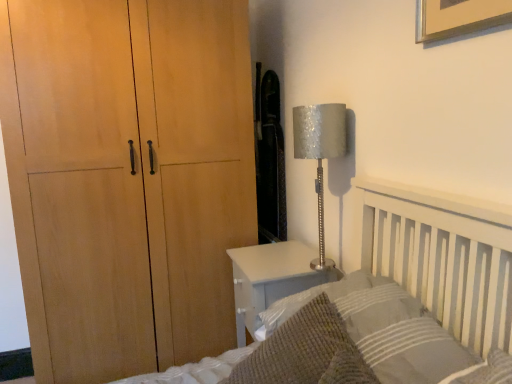
This screenshot has height=384, width=512. I want to click on knitted wool throw pillow at lower right, so click(x=306, y=352).

Locate an element on the screen. The width and height of the screenshot is (512, 384). silver textured lampshade at right is located at coordinates (320, 153).

The height and width of the screenshot is (384, 512). Describe the element at coordinates (271, 278) in the screenshot. I see `white glossy nightstand at lower right` at that location.

Locate an element on the screen. The width and height of the screenshot is (512, 384). textured gray pillow at lower right is located at coordinates (384, 328).

Is knitted wool throw pillow at lower right turned away from textured gray pillow at lower right?

Yes, textured gray pillow at lower right is at the back of knitted wool throw pillow at lower right.

Is knitted wool throw pillow at lower right in contact with textured gray pillow at lower right?

knitted wool throw pillow at lower right is not next to textured gray pillow at lower right, and they're not touching.

From a real-world perspective, which is physically below, knitted wool throw pillow at lower right or textured gray pillow at lower right?

knitted wool throw pillow at lower right.

Based on the photo, from the image's perspective, between knitted wool throw pillow at lower right and textured gray pillow at lower right, which one is located above?

From the image's view, textured gray pillow at lower right is above.

The height and width of the screenshot is (384, 512). I want to click on nightstand lying on the left of textured gray pillow at lower right, so click(x=271, y=278).

In the scene shown: Is white glossy nightstand at lower right far from textured gray pillow at lower right?

They are positioned close to each other.

Which of these two, white glossy nightstand at lower right or textured gray pillow at lower right, is smaller?

textured gray pillow at lower right is smaller.

Considering the relative sizes of white glossy nightstand at lower right and textured gray pillow at lower right in the image provided, is white glossy nightstand at lower right taller than textured gray pillow at lower right?

Indeed, white glossy nightstand at lower right has a greater height compared to textured gray pillow at lower right.

Between silver textured lampshade at right and knitted wool throw pillow at lower right, which one has less height?

knitted wool throw pillow at lower right.

From the image's perspective, is silver textured lampshade at right positioned above or below knitted wool throw pillow at lower right?

Clearly, from the image's perspective, silver textured lampshade at right is above knitted wool throw pillow at lower right.

Does silver textured lampshade at right have a smaller size compared to knitted wool throw pillow at lower right?

Indeed, silver textured lampshade at right has a smaller size compared to knitted wool throw pillow at lower right.

From the picture: Does knitted wool throw pillow at lower right have a smaller size compared to white glossy nightstand at lower right?

Correct, knitted wool throw pillow at lower right occupies less space than white glossy nightstand at lower right.

How distant is knitted wool throw pillow at lower right from white glossy nightstand at lower right?

knitted wool throw pillow at lower right and white glossy nightstand at lower right are 18.97 inches apart.

From their relative heights in the image, would you say knitted wool throw pillow at lower right is taller or shorter than white glossy nightstand at lower right?

knitted wool throw pillow at lower right is shorter than white glossy nightstand at lower right.

Is point (249, 262) closer or farther from the camera than point (340, 322)?

Point (249, 262) appears to be farther away from the viewer than point (340, 322).

This screenshot has height=384, width=512. Find the location of `throw pillow above the white glossy nightstand at lower right (from a real-world perspective)`. throw pillow above the white glossy nightstand at lower right (from a real-world perspective) is located at coordinates (306, 352).

Does white glossy nightstand at lower right have a lesser height compared to knitted wool throw pillow at lower right?

In fact, white glossy nightstand at lower right may be taller than knitted wool throw pillow at lower right.

Is white glossy nightstand at lower right facing towards knitted wool throw pillow at lower right?

No, white glossy nightstand at lower right is not oriented towards knitted wool throw pillow at lower right.

From the picture: From a real-world perspective, is textured gray pillow at lower right located higher than white glossy nightstand at lower right?

Yes, from a real-world perspective, textured gray pillow at lower right is over white glossy nightstand at lower right

Considering the sizes of objects textured gray pillow at lower right and white glossy nightstand at lower right in the image provided, who is thinner, textured gray pillow at lower right or white glossy nightstand at lower right?

Thinner between the two is textured gray pillow at lower right.

Is textured gray pillow at lower right completely or partially outside of white glossy nightstand at lower right?

That's correct, textured gray pillow at lower right is outside of white glossy nightstand at lower right.

Which is in front, point (391, 329) or point (241, 312)?

Point (391, 329)

In the image, there is a silver textured lampshade at right. Where is `throw pillow below it (from a real-world perspective)`? throw pillow below it (from a real-world perspective) is located at coordinates (306, 352).

Based on the photo, is knitted wool throw pillow at lower right directly adjacent to silver textured lampshade at right?

No.

Considering the relative positions of knitted wool throw pillow at lower right and silver textured lampshade at right in the image provided, is knitted wool throw pillow at lower right to the left or to the right of silver textured lampshade at right?

From the image, it's evident that knitted wool throw pillow at lower right is to the left of silver textured lampshade at right.

Can you confirm if knitted wool throw pillow at lower right is taller than silver textured lampshade at right?

In fact, knitted wool throw pillow at lower right may be shorter than silver textured lampshade at right.

This screenshot has width=512, height=384. Identify the location of throw pillow on the left of textured gray pillow at lower right. point(306,352).

In order to click on nightstand located behind the textured gray pillow at lower right in this screenshot , I will do `click(271, 278)`.

Considering their positions, is silver textured lampshade at right positioned further to knitted wool throw pillow at lower right than textured gray pillow at lower right?

silver textured lampshade at right lies further to knitted wool throw pillow at lower right than the other object.

Considering their positions, is white glossy nightstand at lower right positioned further to silver textured lampshade at right than textured gray pillow at lower right?

textured gray pillow at lower right is positioned further to the anchor silver textured lampshade at right.

When comparing their distances from silver textured lampshade at right, does white glossy nightstand at lower right or knitted wool throw pillow at lower right seem further?

knitted wool throw pillow at lower right.

Which object lies nearer to the anchor point white glossy nightstand at lower right, silver textured lampshade at right or textured gray pillow at lower right?

Based on the image, textured gray pillow at lower right appears to be nearer to white glossy nightstand at lower right.

Based on their spatial positions, is white glossy nightstand at lower right or textured gray pillow at lower right further from knitted wool throw pillow at lower right?

The object further to knitted wool throw pillow at lower right is white glossy nightstand at lower right.

Looking at the image, which one is located closer to white glossy nightstand at lower right, silver textured lampshade at right or knitted wool throw pillow at lower right?

The object closer to white glossy nightstand at lower right is knitted wool throw pillow at lower right.

Which object lies further to the anchor point knitted wool throw pillow at lower right, textured gray pillow at lower right or silver textured lampshade at right?

Among the two, silver textured lampshade at right is located further to knitted wool throw pillow at lower right.

Looking at the image, which one is located closer to white glossy nightstand at lower right, textured gray pillow at lower right or knitted wool throw pillow at lower right?

textured gray pillow at lower right lies closer to white glossy nightstand at lower right than the other object.

Image resolution: width=512 pixels, height=384 pixels. What are the coordinates of `table lamp between textured gray pillow at lower right and white glossy nightstand at lower right along the z-axis` in the screenshot? It's located at (320, 153).

At what (x,y) coordinates should I click in order to perform the action: click on pillow between knitted wool throw pillow at lower right and white glossy nightstand at lower right from front to back. Please return your answer as a coordinate pair (x, y). Looking at the image, I should click on (384, 328).

Locate an element on the screen. table lamp between knitted wool throw pillow at lower right and white glossy nightstand at lower right in the front-back direction is located at coordinates (320, 153).

Identify the location of pillow located between knitted wool throw pillow at lower right and silver textured lampshade at right in the depth direction. (384, 328).